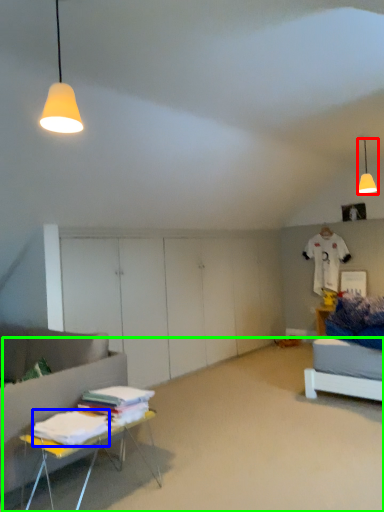
Question: Estimate the real-world distances between objects in this image. Which object is closer to lamp (highlighted by a red box), sheet (highlighted by a blue box) or plain (highlighted by a green box)?

Choices:
 (A) sheet
 (B) plain

Answer: (B)